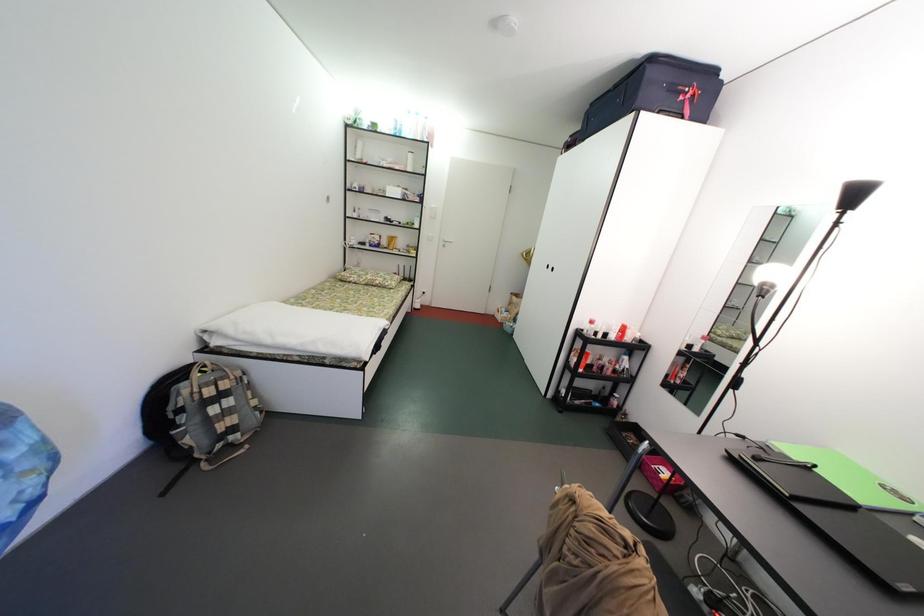
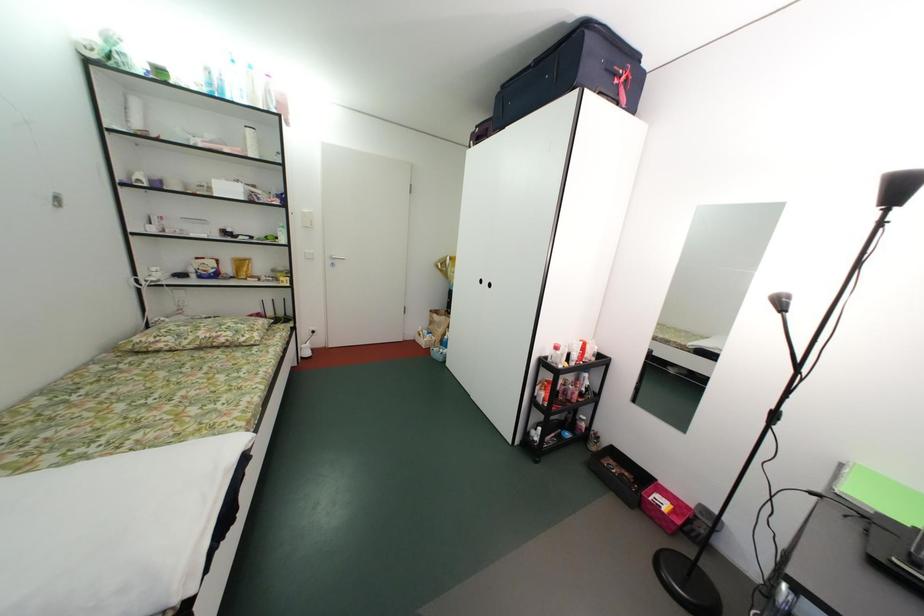
Question: The images are taken continuously from a first-person perspective. In which direction is your viewpoint rotating?

Choices:
 (A) Left
 (B) Right
 (C) Up
 (D) Down

Answer: (B)